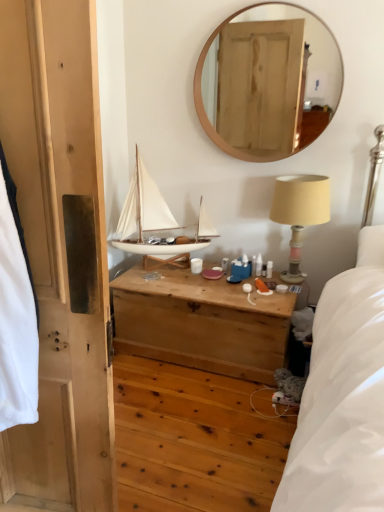
You are a GUI agent. You are given a task and a screenshot of the screen. Output one action in this format:
    pyautogui.click(x=<x>, y=<y>)
    Task: Click on the vacant space in front of white matte sailboat at center
    
    Given the screenshot: What is the action you would take?
    pyautogui.click(x=172, y=287)